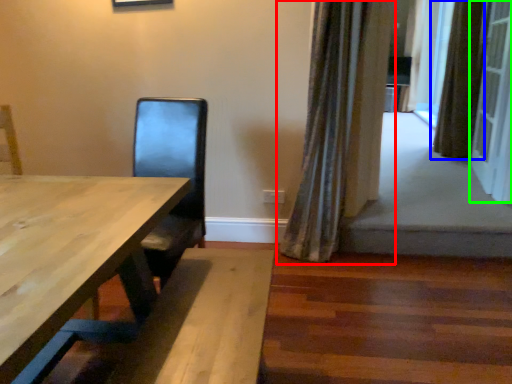
Question: Based on their relative distances, which object is nearer to curtain (highlighted by a red box)? Choose from curtain (highlighted by a blue box) and screen door (highlighted by a green box).

Choices:
 (A) curtain
 (B) screen door

Answer: (B)